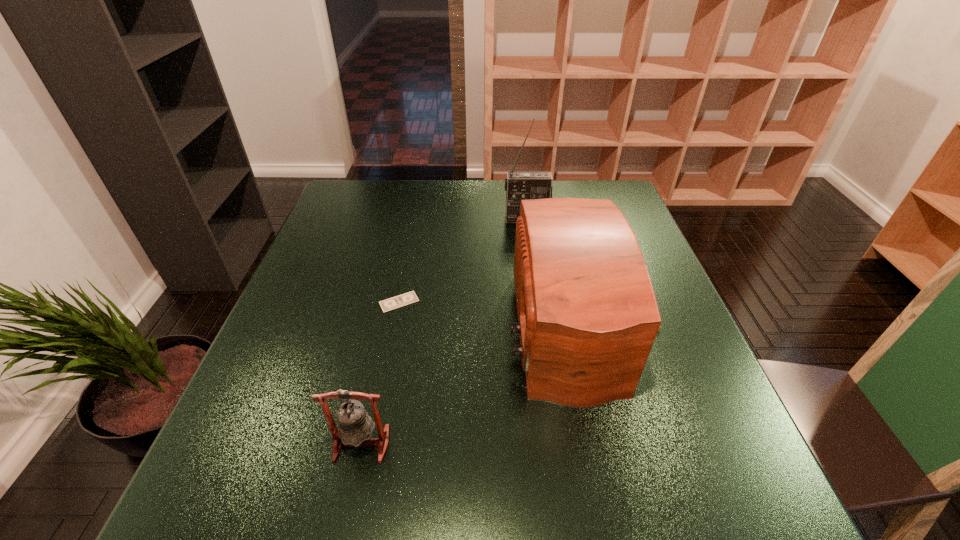
The width and height of the screenshot is (960, 540). I want to click on free space between the bell and the second tallest object, so click(472, 385).

Where is `blank region between the shortest object and the farthest object`? blank region between the shortest object and the farthest object is located at coordinates (463, 260).

You are a GUI agent. You are given a task and a screenshot of the screen. Output one action in this format:
    pyautogui.click(x=<x>, y=<y>)
    Task: Click on the vacant area between the shortest object and the bell
    This screenshot has height=540, width=960.
    Given the screenshot: What is the action you would take?
    pyautogui.click(x=380, y=373)

Identify the location of free space between the nearer radio receiver and the shortest object. The height and width of the screenshot is (540, 960). (492, 314).

Locate an element on the screen. The width and height of the screenshot is (960, 540). free space between the money and the nearest object is located at coordinates (380, 373).

You are a GUI agent. You are given a task and a screenshot of the screen. Output one action in this format:
    pyautogui.click(x=<x>, y=<y>)
    Task: Click on the vacant space that's between the second tallest object and the bell
    The image size is (960, 540).
    Given the screenshot: What is the action you would take?
    pyautogui.click(x=472, y=385)

Locate an element on the screen. free point between the shortest object and the shorter radio receiver is located at coordinates (492, 314).

Find the location of `vacant space that is in between the tallest object and the second shortest object`. vacant space that is in between the tallest object and the second shortest object is located at coordinates (444, 331).

Locate an element on the screen. This screenshot has width=960, height=540. free spot between the third shortest object and the bell is located at coordinates (472, 385).

Image resolution: width=960 pixels, height=540 pixels. Find the location of `vacant space that's between the second tallest object and the nearest object`. vacant space that's between the second tallest object and the nearest object is located at coordinates (472, 385).